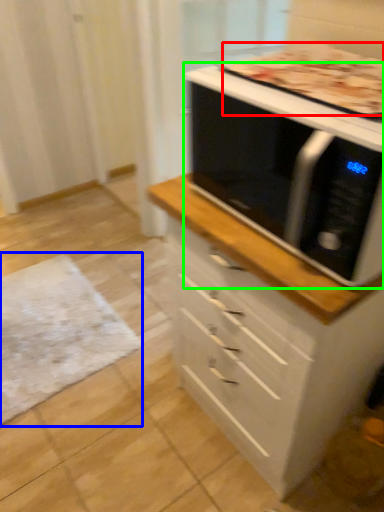
Question: Considering the real-world distances, which object is closest to pizza (highlighted by a red box)? mat (highlighted by a blue box) or microwave oven (highlighted by a green box).

Choices:
 (A) mat
 (B) microwave oven

Answer: (B)